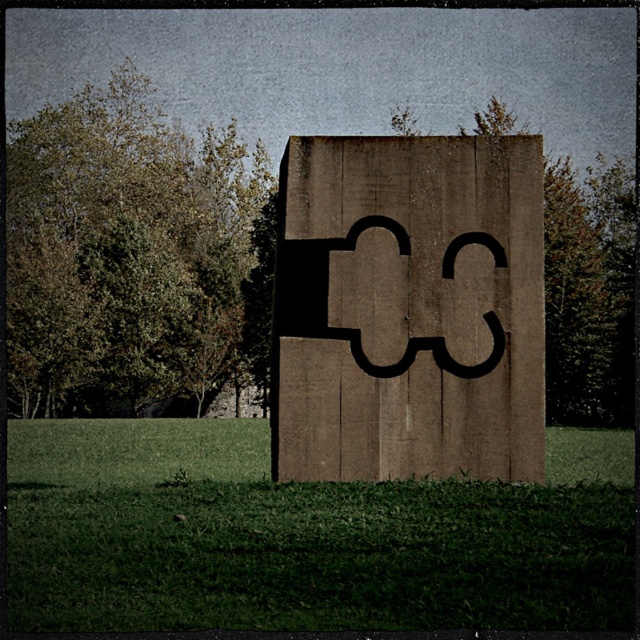
Between point (440, 296) and point (326, 308), which one is positioned in front?

Point (326, 308) is in front.

Which is in front, point (452, 289) or point (356, 339)?

Positioned in front is point (356, 339).

The image size is (640, 640). In order to click on brown concrete sign at center in this screenshot , I will do `click(410, 308)`.

Does green grass at center have a greater width compared to brown concrete sign at center?

Yes.

I want to click on green grass at center, so click(305, 536).

Is the position of green grass at center more distant than that of black concrete number at center?

No, green grass at center is in front of black concrete number at center.

Between green grass at center and black concrete number at center, which one appears on the left side from the viewer's perspective?

Positioned to the left is black concrete number at center.

Looking at this image, who is more distant from viewer, (557,444) or (328,248)?

The point (557,444) is behind.

This screenshot has width=640, height=640. Identify the location of green grass at center. (305, 536).